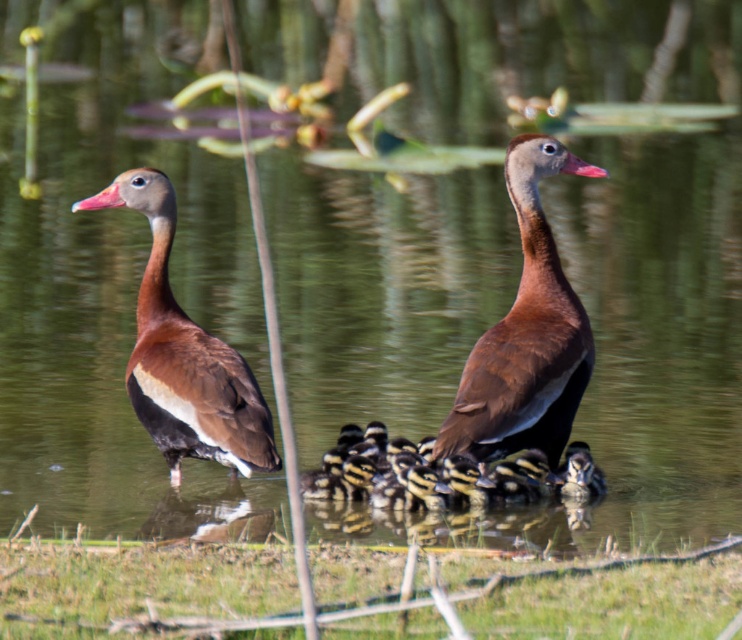
Can you confirm if brown matte duck at center is thinner than brown matte duck at left?

Yes, brown matte duck at center is thinner than brown matte duck at left.

Which is above, brown matte duck at center or brown matte duck at left?

Positioned higher is brown matte duck at center.

Measure the distance between point (531, 145) and camera.

A distance of 5.07 meters exists between point (531, 145) and camera.

Identify the location of brown matte duck at center. 525,333.

Is point (470, 362) closer to camera compared to point (326, 468)?

That is True.

Is brown matte duck at center below yellow-black striped ducklings at center?

Incorrect, brown matte duck at center is not positioned below yellow-black striped ducklings at center.

Who is more forward, (x=562, y=355) or (x=390, y=493)?

Point (x=562, y=355)

In order to click on brown matte duck at center in this screenshot , I will do `click(525, 333)`.

Is green grass at lower center bigger than brown matte duck at left?

Actually, green grass at lower center might be smaller than brown matte duck at left.

Is green grass at lower center positioned behind brown matte duck at left?

No, green grass at lower center is closer to the viewer.

Describe the element at coordinates (528, 593) in the screenshot. I see `green grass at lower center` at that location.

The image size is (742, 640). I want to click on green grass at lower center, so (x=528, y=593).